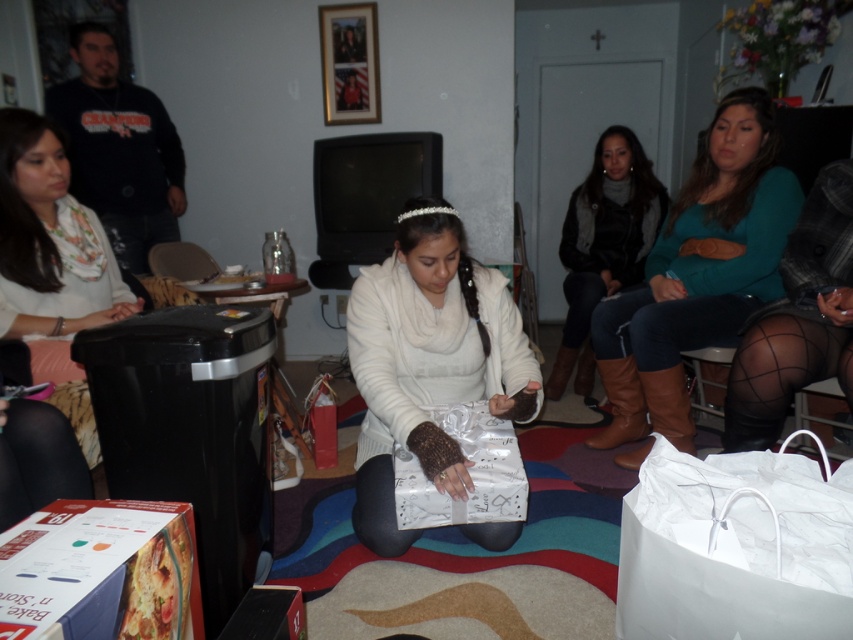
Question: Estimate the real-world distances between objects in this image. Which object is farther from the white cardboard box at lower left?

Choices:
 (A) white glossy shopping bag at center
 (B) white floral scarf at left
 (C) white knitted sweater at center

Answer: (B)

Question: Does white cardboard box at lower left come behind white glossy shopping bag at center?

Choices:
 (A) no
 (B) yes

Answer: (A)

Question: Estimate the real-world distances between objects in this image. Which object is closer to the white paper bag at lower right?

Choices:
 (A) white cardboard box at lower left
 (B) white knitted sweater at center
 (C) white floral scarf at left
 (D) teal sweater at upper right

Answer: (A)

Question: Which of these objects is positioned farthest from the white glossy shopping bag at center?

Choices:
 (A) dark brown leather boots at center right
 (B) white paper bag at lower right
 (C) white knitted sweater at center
 (D) teal sweater at upper right

Answer: (A)

Question: Does white knitted sweater at center appear under white floral scarf at left?

Choices:
 (A) no
 (B) yes

Answer: (B)

Question: Does white floral scarf at left appear on the left side of white glossy shopping bag at center?

Choices:
 (A) yes
 (B) no

Answer: (A)